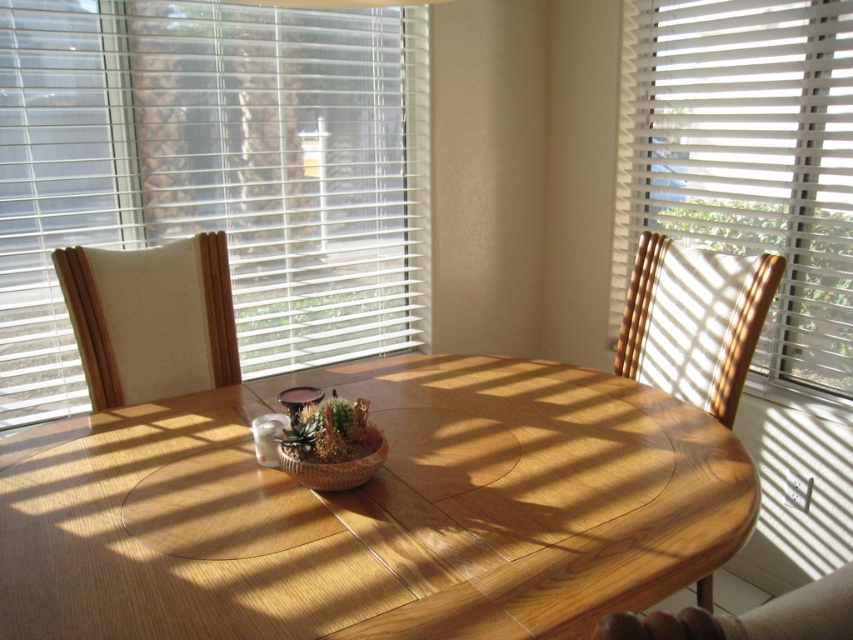
Question: Does light brown wood table at center appear over transparent glass vase at center?

Choices:
 (A) no
 (B) yes

Answer: (A)

Question: Is wooden chair at right wider than wooden chair at lower right?

Choices:
 (A) no
 (B) yes

Answer: (B)

Question: Among these objects, which one is farthest from the camera?

Choices:
 (A) wooden chair at lower right
 (B) light brown wood table at center

Answer: (B)

Question: Which point is closer to the camera?

Choices:
 (A) white fabric chair at left
 (B) white blinds at upper left
 (C) transparent glass vase at center

Answer: (C)

Question: Estimate the real-world distances between objects in this image. Which object is farther from the wooden chair at lower right?

Choices:
 (A) transparent glass vase at center
 (B) white fabric chair at left
 (C) white/smooth blinds at right
 (D) white blinds at upper left

Answer: (D)

Question: Considering the relative positions of light brown wood table at center and transparent glass vase at center in the image provided, where is light brown wood table at center located with respect to transparent glass vase at center?

Choices:
 (A) right
 (B) left

Answer: (A)